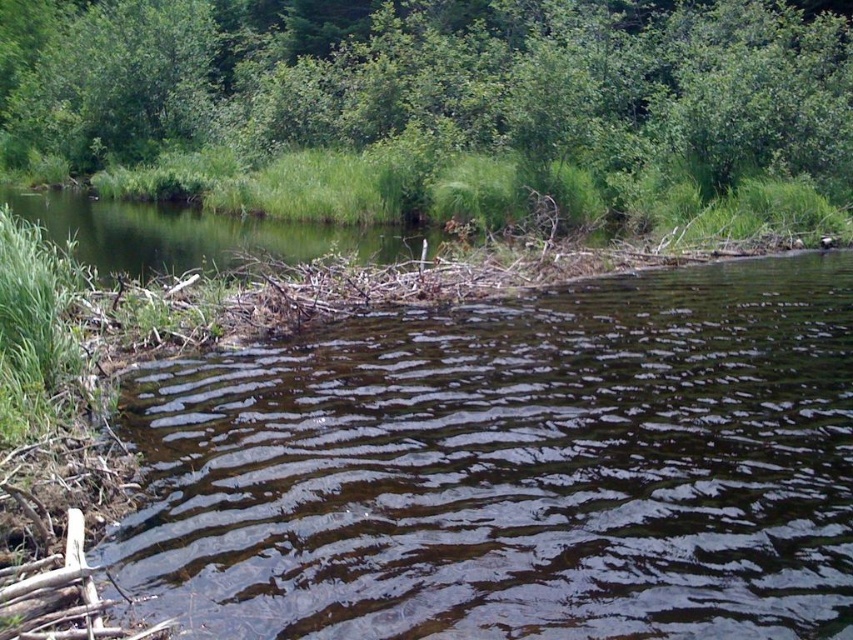
You are standing at the center of the image and want to walk towards the green grassy river at upper left. Which direction should you turn to face the green leafy tree at upper center?

The green leafy tree at upper center is to the right of the green grassy river at upper left. Since you want to face the green leafy tree at upper center, you should turn to your right from the green grassy river at upper left.

You are an environmental scientist assessing the ecosystem of this area. You observe the green leafy tree at upper center and the green grassy river at upper left. Which of these two features is significantly larger in height?

The green leafy tree at upper center is much taller than the green grassy river at upper left, making it significantly larger in height.